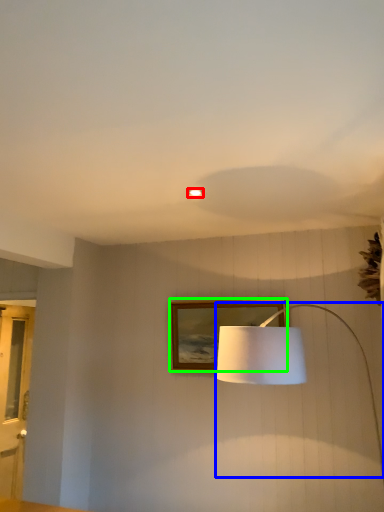
Question: Based on their relative distances, which object is nearer to lighting (highlighted by a red box)? Choose from lamp (highlighted by a blue box) and picture frame (highlighted by a green box).

Choices:
 (A) lamp
 (B) picture frame

Answer: (A)